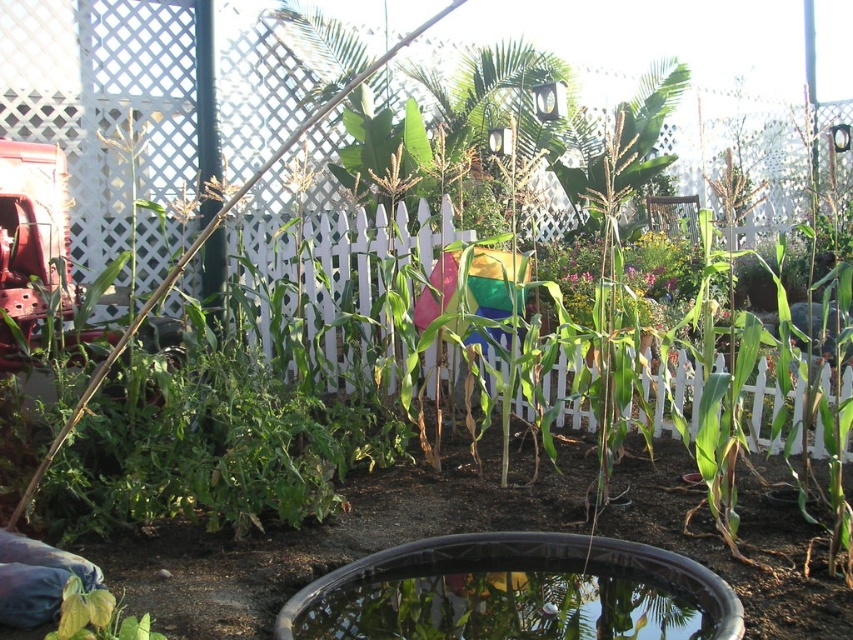
Question: Can you confirm if black rubber fish pond at lower center is positioned to the left of green leafy plant at lower left?

Choices:
 (A) no
 (B) yes

Answer: (A)

Question: Is black rubber fish pond at lower center positioned before green leafy plant at lower left?

Choices:
 (A) yes
 (B) no

Answer: (B)

Question: Which object is farther from the camera taking this photo?

Choices:
 (A) black rubber fish pond at lower center
 (B) green leafy plant at lower left

Answer: (A)

Question: Does black rubber fish pond at lower center have a greater width compared to green leafy plant at lower left?

Choices:
 (A) no
 (B) yes

Answer: (B)

Question: Which object is farther from the camera taking this photo?

Choices:
 (A) black rubber fish pond at lower center
 (B) green leafy plant at lower left

Answer: (A)